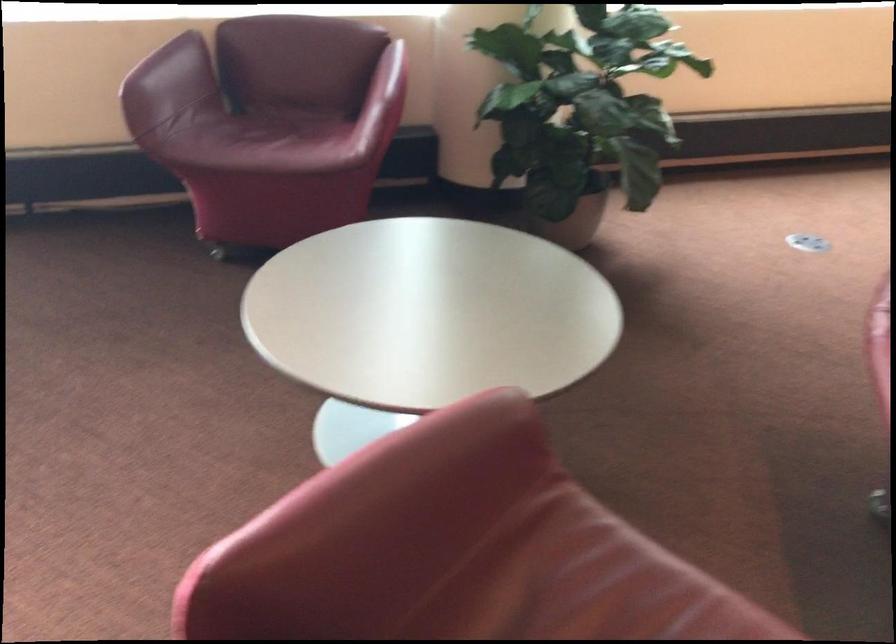
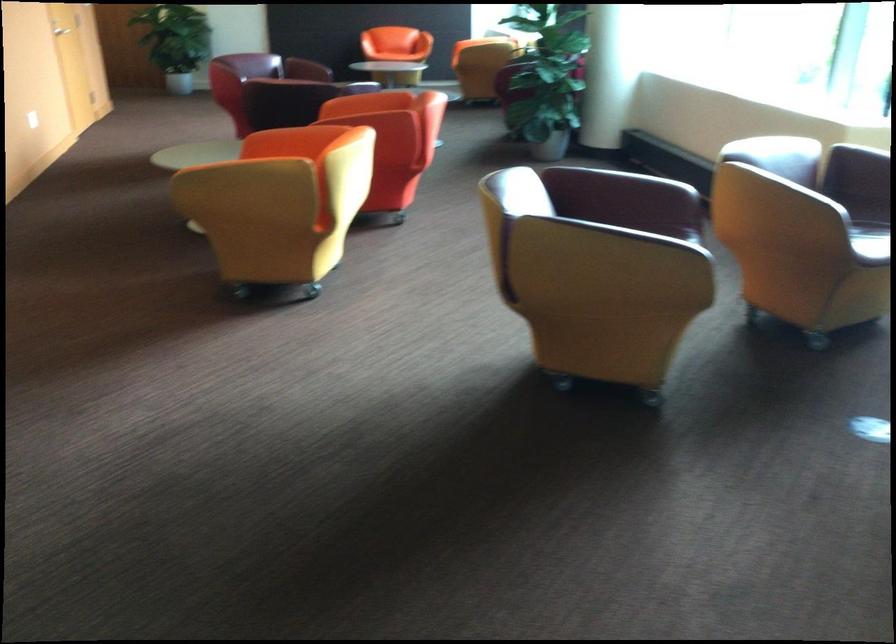
Question: I am providing you with two images of the same scene from different viewpoints. After the viewpoint changes to image2, which objects are now occluded?

Choices:
 (A) purple chair sitting surface
 (B) red control dial
 (C) red chair armrest
 (D) red chair sitting surface

Answer: (D)